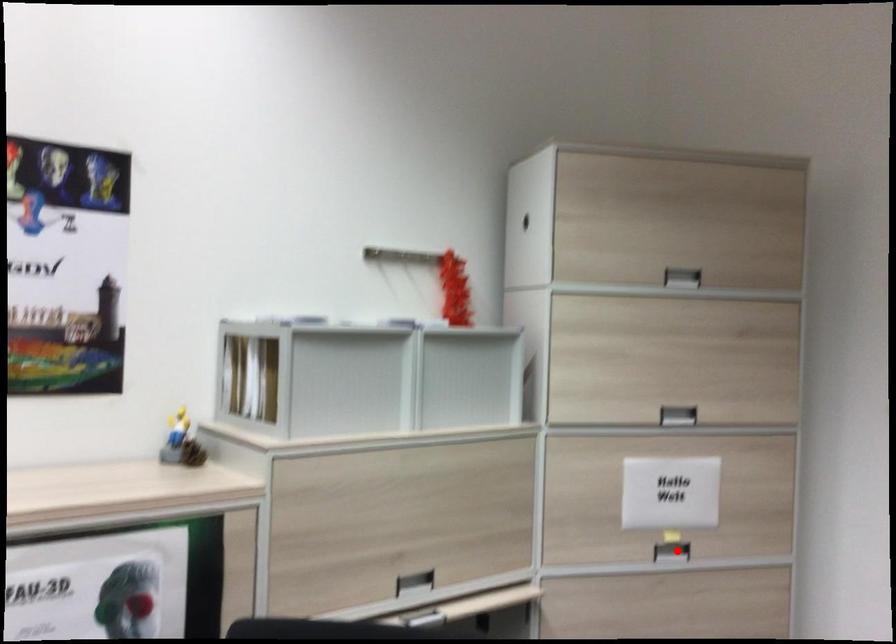
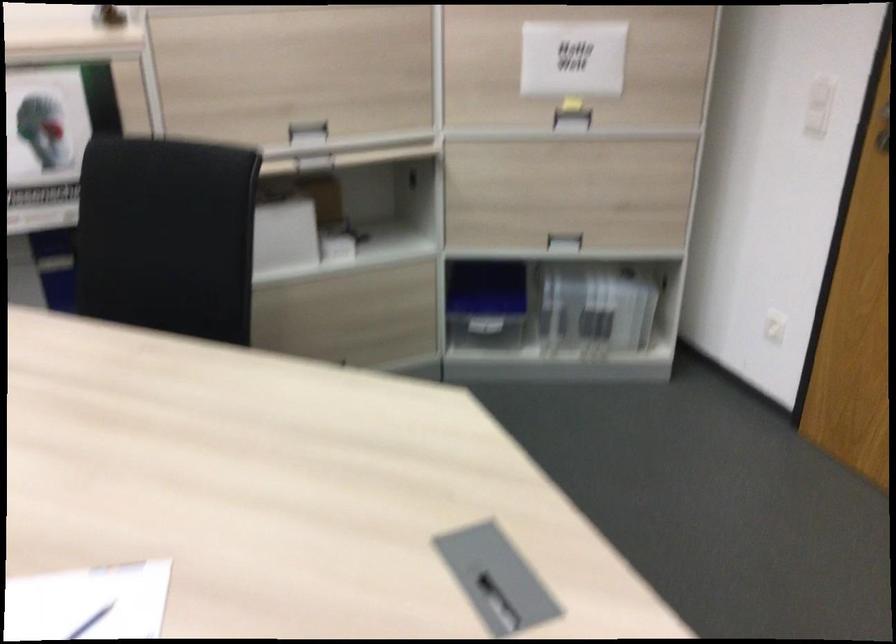
In the second image, find the point that corresponds to the highlighted location in the first image.

(572, 120)